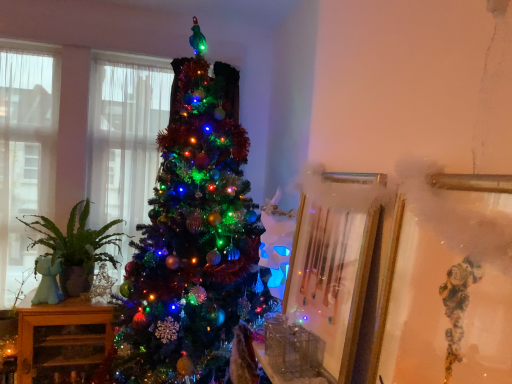
Locate an element on the screen. The width and height of the screenshot is (512, 384). free point above translucent fabric window at left, the 1th window positioned from the right (from a real-world perspective) is located at coordinates (135, 54).